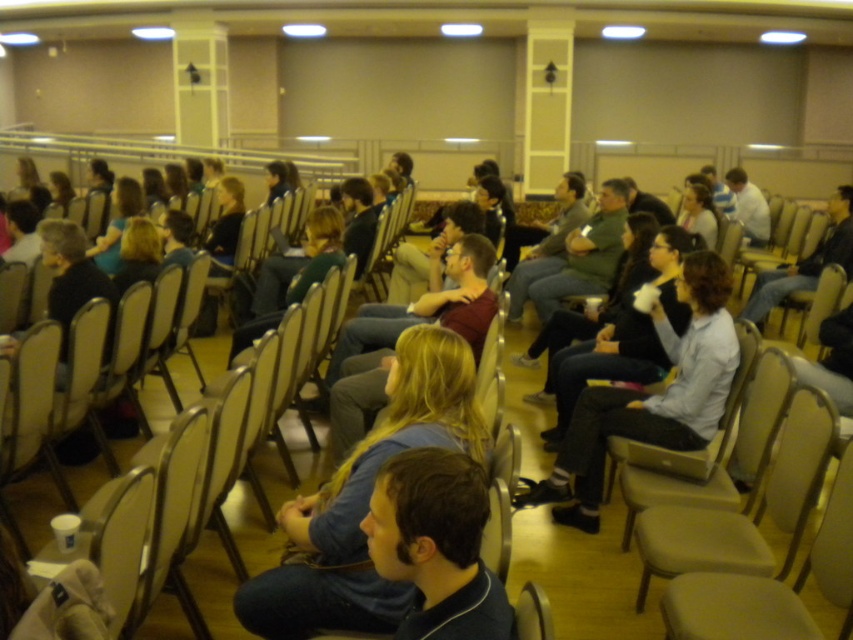
Who is positioned more to the left, dark blue shirt at center or light brown leather jacket at center?

Positioned to the left is dark blue shirt at center.

Is the position of dark blue shirt at center less distant than that of light brown leather jacket at center?

Yes, it is.

Does point (308, 509) lie behind point (711, 230)?

No, (308, 509) is in front of (711, 230).

Where is `dark blue shirt at center`? The image size is (853, 640). dark blue shirt at center is located at coordinates (364, 500).

Measure the distance between light gray fabric jacket at center and camera.

The distance of light gray fabric jacket at center from camera is 2.93 meters.

Does light gray fabric jacket at center have a greater width compared to light brown leather jacket at center?

Yes, light gray fabric jacket at center is wider than light brown leather jacket at center.

Does point (689, 400) come closer to viewer compared to point (704, 224)?

Yes.

Where is `light gray fabric jacket at center`? light gray fabric jacket at center is located at coordinates (650, 397).

Does dark blue shirt at center have a lesser height compared to beige fabric chair at lower right?

Incorrect, dark blue shirt at center's height does not fall short of beige fabric chair at lower right's.

Measure the distance between point (370, 429) and camera.

A distance of 3.42 meters exists between point (370, 429) and camera.

This screenshot has width=853, height=640. Identify the location of dark blue shirt at center. (364, 500).